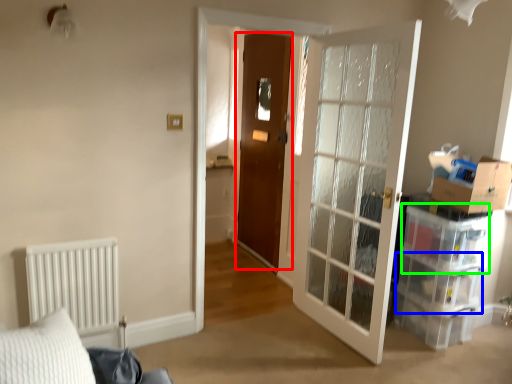
Question: Considering the real-world distances, which object is farthest from door (highlighted by a red box)? drawer (highlighted by a blue box) or storage box (highlighted by a green box)?

Choices:
 (A) drawer
 (B) storage box

Answer: (A)